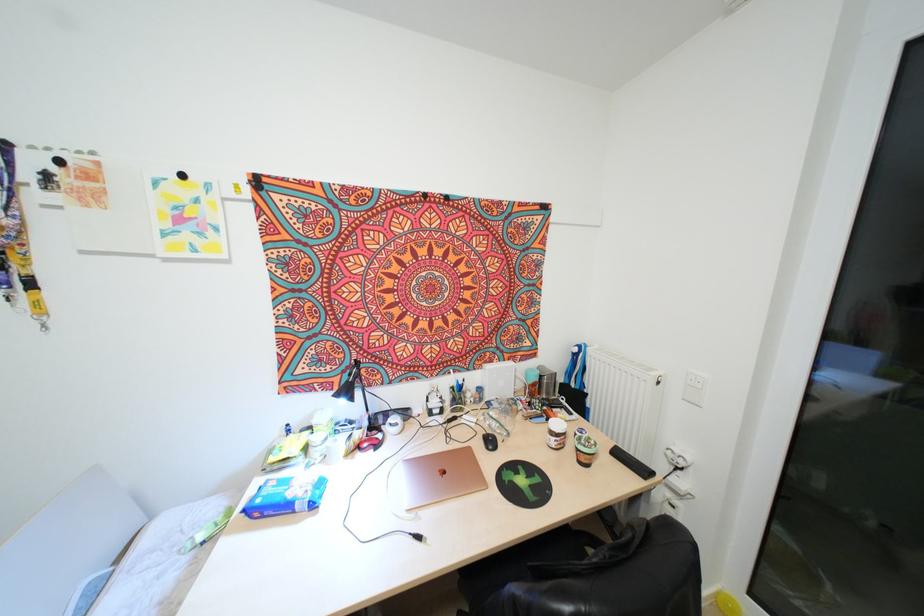
Image resolution: width=924 pixels, height=616 pixels. What do you see at coordinates (532, 554) in the screenshot? I see `the chair sitting surface` at bounding box center [532, 554].